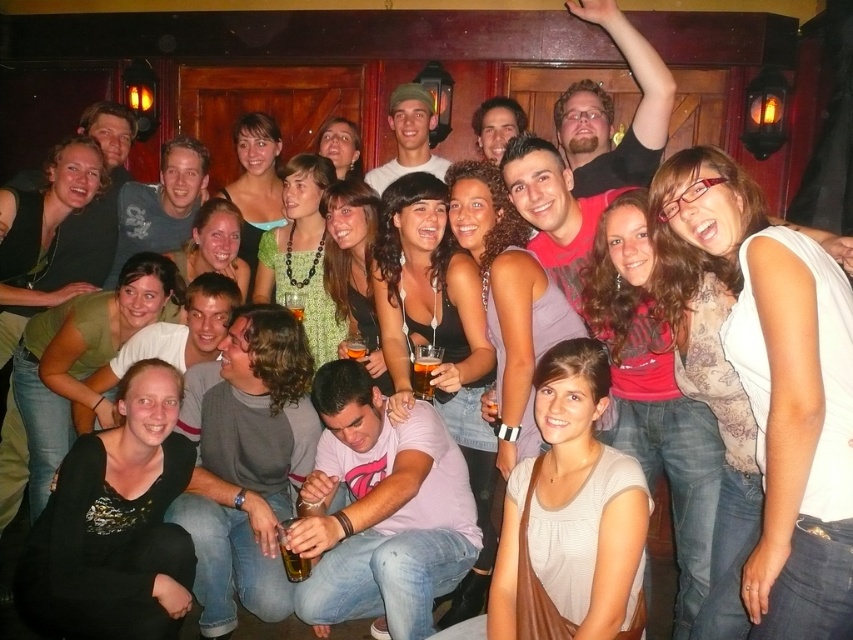
Question: Which object is farther from the camera taking this photo?

Choices:
 (A) matte gray t-shirt at center
 (B) translucent glass beverage at center
 (C) matte blue shirt at center
 (D) pink cotton shirt at center

Answer: (C)

Question: Can you confirm if pink cotton shirt at center is thinner than matte green cap at upper center?

Choices:
 (A) yes
 (B) no

Answer: (B)

Question: Which point is farther to the camera?

Choices:
 (A) matte gray t-shirt at center
 (B) translucent glass bottle at lower center

Answer: (B)

Question: Is matte blue shirt at center to the right of translucent glass beer at center from the viewer's perspective?

Choices:
 (A) yes
 (B) no

Answer: (B)

Question: Considering the relative positions of pink cotton shirt at center and matte blue shirt at center in the image provided, where is pink cotton shirt at center located with respect to matte blue shirt at center?

Choices:
 (A) left
 (B) right

Answer: (B)

Question: Which object is closer to the camera taking this photo?

Choices:
 (A) amber glass beer at center
 (B) translucent glass beverage at center
 (C) translucent glass beer at center

Answer: (B)